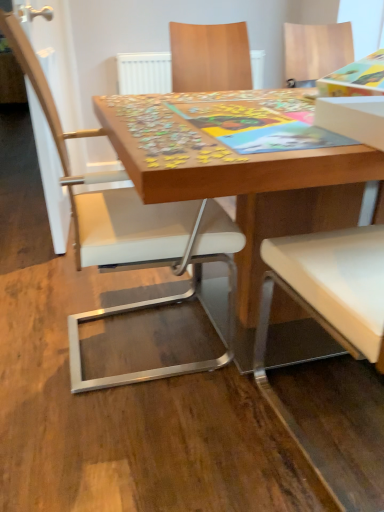
Question: From a real-world perspective, is white leather chair at center physically located above or below wooden puzzle pieces at center?

Choices:
 (A) below
 (B) above

Answer: (B)

Question: Considering the positions of white leather chair at center and wooden puzzle pieces at center in the image, is white leather chair at center wider or thinner than wooden puzzle pieces at center?

Choices:
 (A) wide
 (B) thin

Answer: (B)

Question: Estimate the real-world distances between objects in this image. Which object is closer to the wooden puzzle board at center?

Choices:
 (A) white leather chair at center
 (B) wooden puzzle pieces at center

Answer: (A)

Question: Which is farther from the white leather chair at center?

Choices:
 (A) wooden puzzle pieces at center
 (B) wooden puzzle board at center

Answer: (B)